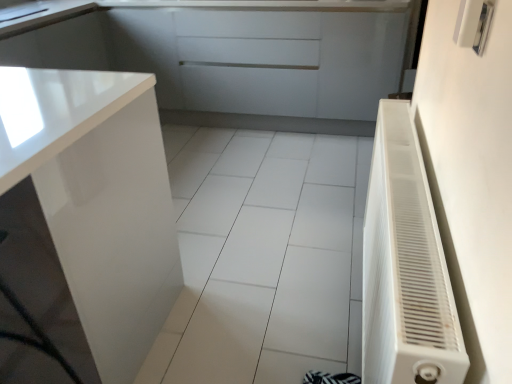
What is the approximate width of white glossy tile at center?

It is 5.89 feet.

Image resolution: width=512 pixels, height=384 pixels. Describe the element at coordinates (241, 60) in the screenshot. I see `glossy white cabinet at upper left, placed as the 2th cabinetry when sorted from front to back` at that location.

This screenshot has height=384, width=512. Identify the location of white plastic radiator at right. (405, 267).

Who is smaller, white glossy sink at upper left or metallic silver switch at upper right?

metallic silver switch at upper right is smaller.

Is white glossy sink at upper left wider than metallic silver switch at upper right?

Indeed, white glossy sink at upper left has a greater width compared to metallic silver switch at upper right.

Is white glossy sink at upper left not within metallic silver switch at upper right?

white glossy sink at upper left lies outside metallic silver switch at upper right's area.

From the image's perspective, which object appears higher, white glossy sink at upper left or metallic silver switch at upper right?

white glossy sink at upper left appears higher in the image.

How much distance is there between metallic silver switch at upper right and glossy white cabinet at left, arranged as the first cabinetry when ordered from the bottom?

metallic silver switch at upper right and glossy white cabinet at left, arranged as the first cabinetry when ordered from the bottom, are 1.05 meters apart.

Is metallic silver switch at upper right not inside glossy white cabinet at left, arranged as the first cabinetry when ordered from the bottom?

Yes.

From a real-world perspective, is metallic silver switch at upper right physically above glossy white cabinet at left, which is the 1th cabinetry in front-to-back order?

Correct, in the physical world, metallic silver switch at upper right is higher than glossy white cabinet at left, which is the 1th cabinetry in front-to-back order.

Consider the image. From the image's perspective, is metallic silver switch at upper right under glossy white cabinet at left, arranged as the first cabinetry when ordered from the bottom?

Actually, metallic silver switch at upper right appears above glossy white cabinet at left, arranged as the first cabinetry when ordered from the bottom, in the image.

Can glossy white cabinet at upper left, the 1th cabinetry viewed from the top, be found inside white glossy sink at upper left?

No, glossy white cabinet at upper left, the 1th cabinetry viewed from the top, is not a part of white glossy sink at upper left.

Which is further, (25,14) or (257,120)?

The point (257,120) is farther.

How many degrees apart are the facing directions of white glossy sink at upper left and glossy white cabinet at upper left, the 1th cabinetry viewed from the top?

They differ by 92.6 degrees in their facing directions.

Considering the sizes of objects white glossy sink at upper left and glossy white cabinet at upper left, marked as the 2th cabinetry in a bottom-to-top arrangement, in the image provided, who is smaller, white glossy sink at upper left or glossy white cabinet at upper left, marked as the 2th cabinetry in a bottom-to-top arrangement,?

white glossy sink at upper left is smaller.

Are glossy white cabinet at upper left, the 1th cabinetry viewed from the top, and glossy white cabinet at left, arranged as the first cabinetry when ordered from the bottom, beside each other?

No, glossy white cabinet at upper left, the 1th cabinetry viewed from the top, is not with glossy white cabinet at left, arranged as the first cabinetry when ordered from the bottom.

Which point is more forward, (238,92) or (50,171)?

Point (50,171)

Visually, is glossy white cabinet at upper left, placed as the 2th cabinetry when sorted from front to back, positioned to the left or to the right of glossy white cabinet at left, which is the 2th cabinetry in top-to-bottom order?

In the image, glossy white cabinet at upper left, placed as the 2th cabinetry when sorted from front to back, appears on the right side of glossy white cabinet at left, which is the 2th cabinetry in top-to-bottom order.

Considering the sizes of objects glossy white cabinet at upper left, placed as the 2th cabinetry when sorted from front to back, and glossy white cabinet at left, the 2th cabinetry when ordered from back to front, in the image provided, who is shorter, glossy white cabinet at upper left, placed as the 2th cabinetry when sorted from front to back, or glossy white cabinet at left, the 2th cabinetry when ordered from back to front,?

glossy white cabinet at upper left, placed as the 2th cabinetry when sorted from front to back, is shorter.

From the image's perspective, would you say white glossy tile at center is shown under white glossy sink at upper left?

Correct, white glossy tile at center appears lower than white glossy sink at upper left in the image.

Is white glossy tile at center smaller than white glossy sink at upper left?

No, white glossy tile at center is not smaller than white glossy sink at upper left.

Which object is wider, white glossy tile at center or white glossy sink at upper left?

With larger width is white glossy tile at center.

Measure the distance between white glossy sink at upper left and white plastic radiator at right.

white glossy sink at upper left is 7.36 feet from white plastic radiator at right.

Is white glossy sink at upper left shorter than white plastic radiator at right?

Yes, white glossy sink at upper left is shorter than white plastic radiator at right.

From a real-world perspective, is white glossy sink at upper left physically below white plastic radiator at right?

No, from a real-world perspective, white glossy sink at upper left is not under white plastic radiator at right.

Is white glossy sink at upper left turned away from white plastic radiator at right?

No.

Locate an element on the screen. The height and width of the screenshot is (384, 512). sink above the white plastic radiator at right (from the image's perspective) is located at coordinates (21, 11).

Would you say white plastic radiator at right is to the left or to the right of white glossy sink at upper left in the picture?

white plastic radiator at right is positioned on white glossy sink at upper left's right side.

How different are the orientations of white plastic radiator at right and white glossy sink at upper left in degrees?

They differ by 176 degrees in their facing directions.

Is white plastic radiator at right not within white glossy sink at upper left?

Absolutely, white plastic radiator at right is external to white glossy sink at upper left.

The image size is (512, 384). I want to click on sink above the metallic silver switch at upper right (from the image's perspective), so click(x=21, y=11).

The width and height of the screenshot is (512, 384). Find the location of `cabinetry lying below the metallic silver switch at upper right (from the image's perspective)`. cabinetry lying below the metallic silver switch at upper right (from the image's perspective) is located at coordinates (98, 199).

Estimate the real-world distances between objects in this image. Which object is closer to white glossy tile at center, glossy white cabinet at left, arranged as the first cabinetry when ordered from the bottom, or white plastic radiator at right?

Answer: glossy white cabinet at left, arranged as the first cabinetry when ordered from the bottom, is closer to white glossy tile at center.

Estimate the real-world distances between objects in this image. Which object is further from metallic silver switch at upper right, glossy white cabinet at upper left, marked as the 2th cabinetry in a bottom-to-top arrangement, or glossy white cabinet at left, arranged as the first cabinetry when ordered from the bottom?

Among the two, glossy white cabinet at upper left, marked as the 2th cabinetry in a bottom-to-top arrangement, is located further to metallic silver switch at upper right.

Considering their positions, is white glossy sink at upper left positioned further to glossy white cabinet at upper left, marked as the first cabinetry in a back-to-front arrangement, than white glossy tile at center?

Among the two, white glossy sink at upper left is located further to glossy white cabinet at upper left, marked as the first cabinetry in a back-to-front arrangement.

Looking at this image, looking at the image, which one is located further to metallic silver switch at upper right, white plastic radiator at right or white glossy tile at center?

Based on the image, white glossy tile at center appears to be further to metallic silver switch at upper right.

From the image, which object appears to be nearer to white glossy tile at center, glossy white cabinet at upper left, placed as the 2th cabinetry when sorted from front to back, or glossy white cabinet at left, the 2th cabinetry when ordered from back to front?

glossy white cabinet at left, the 2th cabinetry when ordered from back to front, lies closer to white glossy tile at center than the other object.

Based on their spatial positions, is white glossy sink at upper left or metallic silver switch at upper right further from glossy white cabinet at left, the 2th cabinetry when ordered from back to front?

Among the two, white glossy sink at upper left is located further to glossy white cabinet at left, the 2th cabinetry when ordered from back to front.

Considering their positions, is glossy white cabinet at left, which is the 1th cabinetry in front-to-back order, positioned further to white glossy tile at center than metallic silver switch at upper right?

The object further to white glossy tile at center is metallic silver switch at upper right.

Looking at this image, when comparing their distances from white glossy sink at upper left, does white glossy tile at center or glossy white cabinet at upper left, marked as the first cabinetry in a back-to-front arrangement, seem closer?

glossy white cabinet at upper left, marked as the first cabinetry in a back-to-front arrangement, is positioned closer to the anchor white glossy sink at upper left.

Identify the location of ceramic tile between glossy white cabinet at left, arranged as the first cabinetry when ordered from the bottom, and white glossy sink at upper left in the front-back direction. The width and height of the screenshot is (512, 384). (264, 256).

Image resolution: width=512 pixels, height=384 pixels. Identify the location of ceramic tile between glossy white cabinet at left, which is the 1th cabinetry in front-to-back order, and glossy white cabinet at upper left, marked as the first cabinetry in a back-to-front arrangement, along the z-axis. (264, 256).

Identify the location of ceramic tile between metallic silver switch at upper right and glossy white cabinet at upper left, the 1th cabinetry viewed from the top, from front to back. (264, 256).

Locate an element on the screen. The height and width of the screenshot is (384, 512). air conditioner between white glossy tile at center and metallic silver switch at upper right is located at coordinates (405, 267).